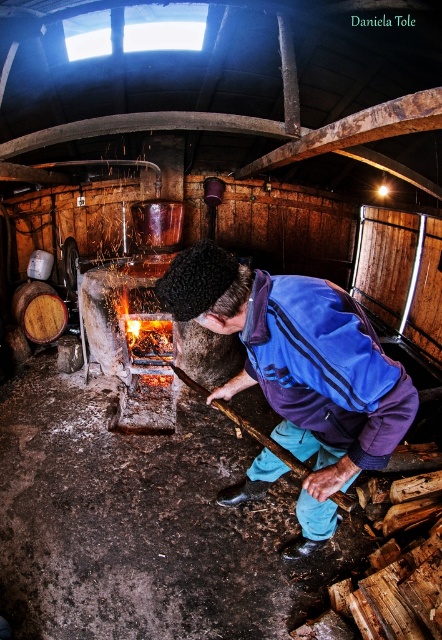
You are a visitor in this distillery and want to know if the blue fleece jacket at center could fit into the wooden barrel at left. Based on their sizes, can it fit?

The blue fleece jacket at center might be wider than wooden barrel at left, so it may not fit inside the wooden barrel at left.

You are a visitor in this distillery and want to take a photo of the wooden barrel at left without the blue fleece jacket at center blocking the view. Is the jacket currently blocking the barrel?

Yes, the blue fleece jacket at center is in front of wooden barrel at left, so it is blocking the view of the wooden barrel at left.

You are a visitor in this distillery and want to take a photo of the blue fleece jacket at center and the wooden barrel at left. Which object should you focus on first if you want to capture both in the same frame without moving your camera?

The blue fleece jacket at center is bigger than the wooden barrel at left, so you should focus on the wooden barrel at left first to ensure both fit in the frame since smaller objects can be positioned without cropping.